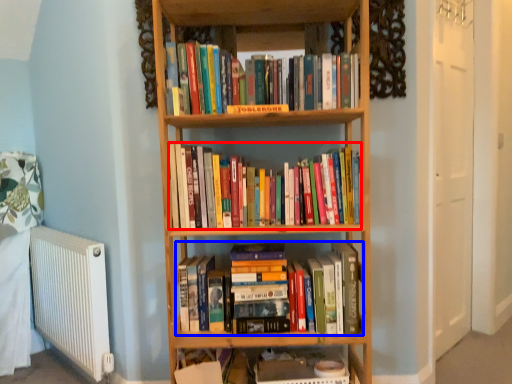
Question: Which object appears farthest to the camera in this image, book (highlighted by a red box) or book (highlighted by a blue box)?

Choices:
 (A) book
 (B) book

Answer: (B)